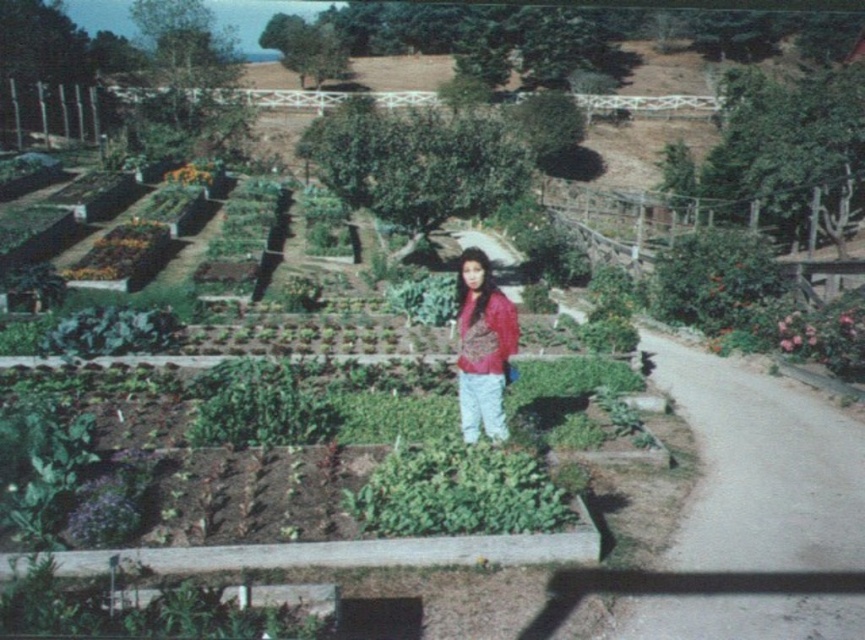
You are a photographer trying to capture a clear shot of the green leafy plant at center and the matte pink blouse at center. Since the plants are tall, you want to ensure the blouse is fully visible. Based on their heights, which object should you focus on first to frame the shot properly?

The green leafy plant at center is not as tall as the matte pink blouse at center, so you should focus on framing the matte pink blouse at center first to ensure it is fully visible in the shot.

You are standing at the point marked by the coordinates point (457,492) in the garden. What do you see directly in front of you?

The point (457,492) marks a green leafy plant at center, so you would see the green leafy plant at center directly in front of you.

You are a photographer trying to capture the matte pink blouse at center and the green leafy plant at center in the same frame. Which object should you position to your left to include both in the shot?

You should position the matte pink blouse at center to your left since the green leafy plant at center is to the right of it.